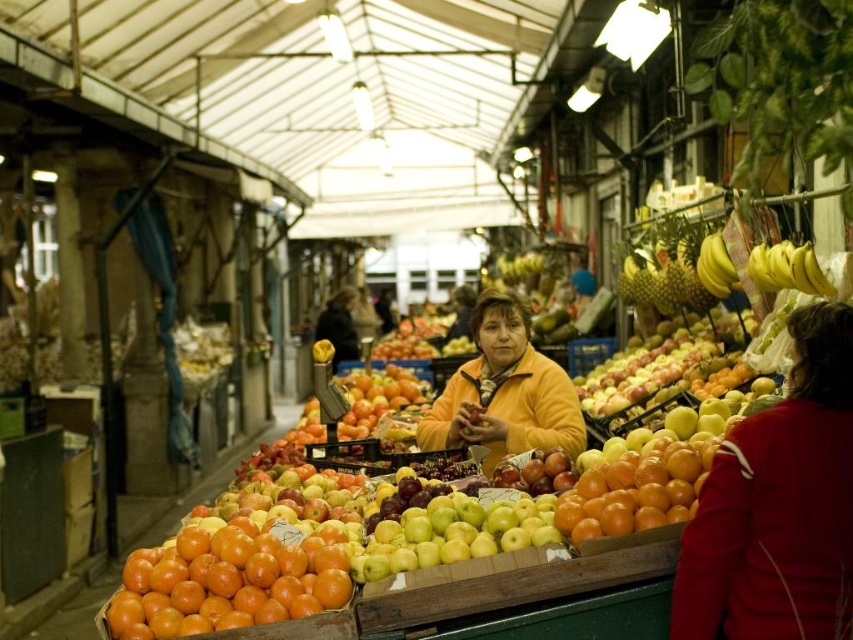
Who is taller, red fleece jacket at lower right or yellow matte bananas at upper right?

With more height is red fleece jacket at lower right.

Is point (712, 532) farther from camera compared to point (782, 256)?

No, (712, 532) is in front of (782, 256).

Locate an element on the screen. This screenshot has width=853, height=640. red fleece jacket at lower right is located at coordinates (778, 506).

Who is shorter, orange fleece jacket at center or yellow matte bananas at upper right?

With less height is yellow matte bananas at upper right.

Does orange fleece jacket at center appear on the left side of yellow matte bananas at upper right?

Indeed, orange fleece jacket at center is positioned on the left side of yellow matte bananas at upper right.

Where is `orange fleece jacket at center`? This screenshot has width=853, height=640. orange fleece jacket at center is located at coordinates pos(503,392).

Where is `red fleece jacket at lower right`? Image resolution: width=853 pixels, height=640 pixels. red fleece jacket at lower right is located at coordinates (778, 506).

Which of these two, red fleece jacket at lower right or orange fleece jacket at center, stands shorter?

With less height is orange fleece jacket at center.

I want to click on red fleece jacket at lower right, so click(778, 506).